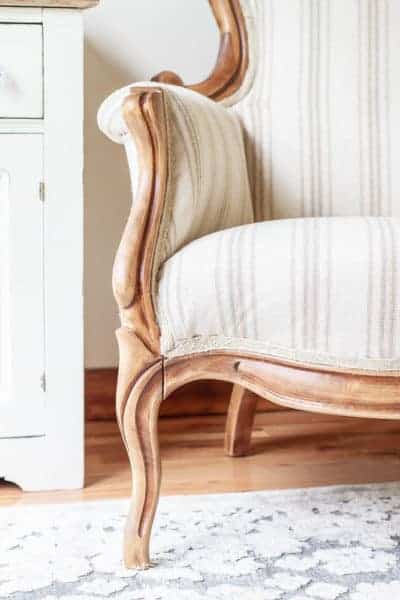
This screenshot has height=600, width=400. In order to click on drawer in this screenshot , I will do `click(6, 65)`.